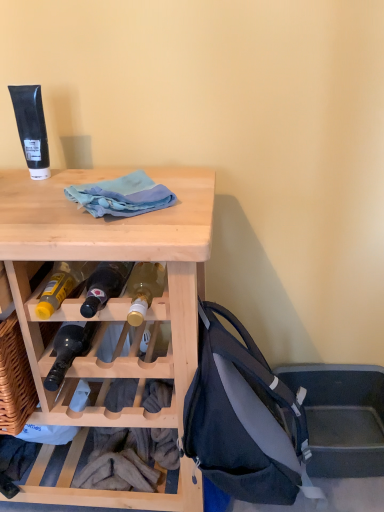
You are a GUI agent. You are given a task and a screenshot of the screen. Output one action in this format:
    pyautogui.click(x=<x>, y=<y>)
    Task: Click on the natural wood desk at upper left
    
    Given the screenshot: What is the action you would take?
    pyautogui.click(x=111, y=311)

Locate an element on the screen. The width and height of the screenshot is (384, 512). matte black backpack at lower right is located at coordinates (242, 417).

Is matte black backpack at lower right at the back of light blue fabric at center?

No.

Does point (104, 209) appear closer or farther from the camera than point (237, 362)?

Point (104, 209) appears to be closer to the viewer than point (237, 362).

Is light blue fabric at center at the left side of matte black backpack at lower right?

Yes, light blue fabric at center is to the left of matte black backpack at lower right.

Can you confirm if light blue fabric at center is shorter than matte black backpack at lower right?

Yes, light blue fabric at center is shorter than matte black backpack at lower right.

Considering the positions of objects matte black backpack at lower right and natural wood desk at upper left in the image provided, who is behind, matte black backpack at lower right or natural wood desk at upper left?

Positioned behind is matte black backpack at lower right.

Is natural wood desk at upper left located within matte black backpack at lower right?

No, natural wood desk at upper left is not a part of matte black backpack at lower right.

Considering the points (231, 492) and (69, 490), which point is behind, point (231, 492) or point (69, 490)?

Point (69, 490)

From a real-world perspective, between matte black backpack at lower right and natural wood desk at upper left, who is vertically higher?

matte black backpack at lower right.

Could you tell me if matte black backpack at lower right is facing light blue fabric at center?

No.

From a real-world perspective, does matte black backpack at lower right sit lower than light blue fabric at center?

Indeed, from a real-world perspective, matte black backpack at lower right is positioned beneath light blue fabric at center.

From the picture: Considering the relative sizes of matte black backpack at lower right and light blue fabric at center in the image provided, is matte black backpack at lower right smaller than light blue fabric at center?

Actually, matte black backpack at lower right might be larger than light blue fabric at center.

How far apart are matte black backpack at lower right and light blue fabric at center?

matte black backpack at lower right is 17.29 inches from light blue fabric at center.

Where is `desk that is in front of the matte black backpack at lower right`? The height and width of the screenshot is (512, 384). desk that is in front of the matte black backpack at lower right is located at coordinates (111, 311).

Considering the sizes of natural wood desk at upper left and matte black backpack at lower right in the image, is natural wood desk at upper left wider or thinner than matte black backpack at lower right?

Considering their sizes, natural wood desk at upper left looks broader than matte black backpack at lower right.

Which object is positioned more to the left, natural wood desk at upper left or matte black backpack at lower right?

From the viewer's perspective, natural wood desk at upper left appears more on the left side.

Which is more distant, (34, 345) or (221, 385)?

Point (34, 345)

Where is `desk below the light blue fabric at center (from the image's perspective)`? The width and height of the screenshot is (384, 512). desk below the light blue fabric at center (from the image's perspective) is located at coordinates (111, 311).

From the image's perspective, which one is positioned lower, light blue fabric at center or natural wood desk at upper left?

natural wood desk at upper left.

Considering their positions, is light blue fabric at center located in front of or behind natural wood desk at upper left?

light blue fabric at center is behind natural wood desk at upper left.

Which of these two, light blue fabric at center or natural wood desk at upper left, is thinner?

Thinner between the two is light blue fabric at center.

Which of these two, natural wood desk at upper left or light blue fabric at center, is bigger?

Bigger between the two is natural wood desk at upper left.

In the scene shown: Between natural wood desk at upper left and light blue fabric at center, which one appears on the left side from the viewer's perspective?

Positioned to the left is natural wood desk at upper left.

Is natural wood desk at upper left not near light blue fabric at center?

natural wood desk at upper left is near light blue fabric at center, not far away.

The width and height of the screenshot is (384, 512). I want to click on cloth located behind the matte black backpack at lower right, so click(x=121, y=196).

Find the location of a particular element. This screenshot has height=512, width=384. desk directly beneath the matte black backpack at lower right (from a real-world perspective) is located at coordinates (111, 311).

Considering their positions, is light blue fabric at center positioned closer to matte black backpack at lower right than natural wood desk at upper left?

natural wood desk at upper left lies closer to matte black backpack at lower right than the other object.

Which object lies further to the anchor point matte black backpack at lower right, natural wood desk at upper left or light blue fabric at center?

Among the two, light blue fabric at center is located further to matte black backpack at lower right.

Considering their positions, is matte black backpack at lower right positioned closer to natural wood desk at upper left than light blue fabric at center?

matte black backpack at lower right lies closer to natural wood desk at upper left than the other object.

Which object lies nearer to the anchor point natural wood desk at upper left, light blue fabric at center or matte black backpack at lower right?

Among the two, matte black backpack at lower right is located nearer to natural wood desk at upper left.

Which object lies further to the anchor point light blue fabric at center, matte black backpack at lower right or natural wood desk at upper left?

matte black backpack at lower right.

From the image, which object appears to be farther from light blue fabric at center, natural wood desk at upper left or matte black backpack at lower right?

The object further to light blue fabric at center is matte black backpack at lower right.

The width and height of the screenshot is (384, 512). Find the location of `desk between light blue fabric at center and matte black backpack at lower right vertically`. desk between light blue fabric at center and matte black backpack at lower right vertically is located at coordinates (111, 311).